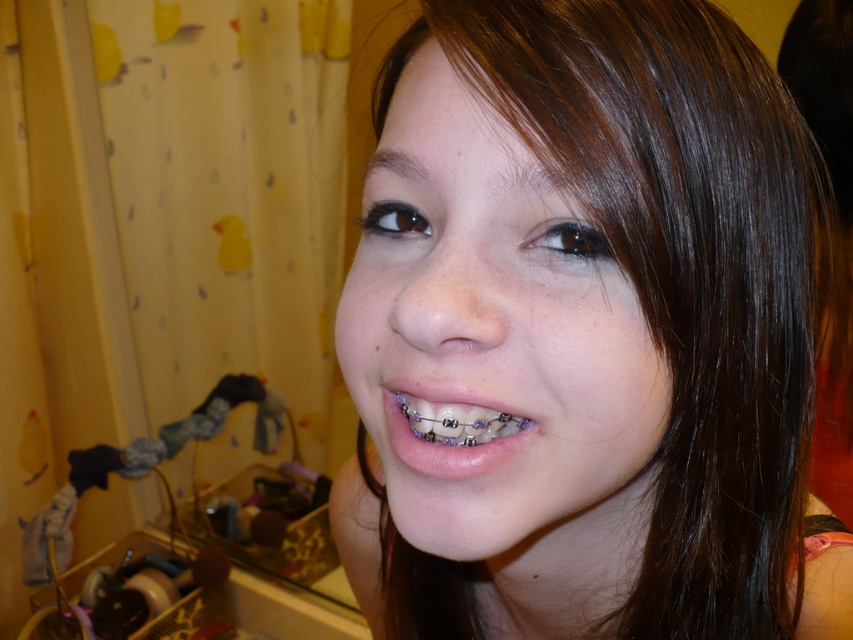
Which of these two, smooth skin face at center or purple metallic braces at center, stands taller?

With more height is smooth skin face at center.

Which is more to the left, smooth skin face at center or purple metallic braces at center?

Positioned to the left is purple metallic braces at center.

This screenshot has width=853, height=640. Describe the element at coordinates (583, 332) in the screenshot. I see `smooth skin face at center` at that location.

Image resolution: width=853 pixels, height=640 pixels. What are the coordinates of `smooth skin face at center` in the screenshot? It's located at (583, 332).